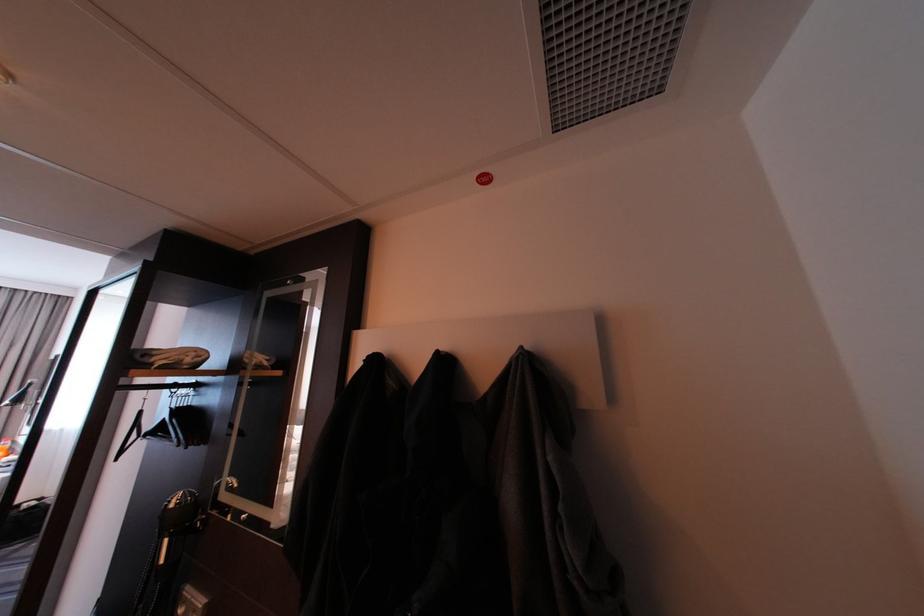
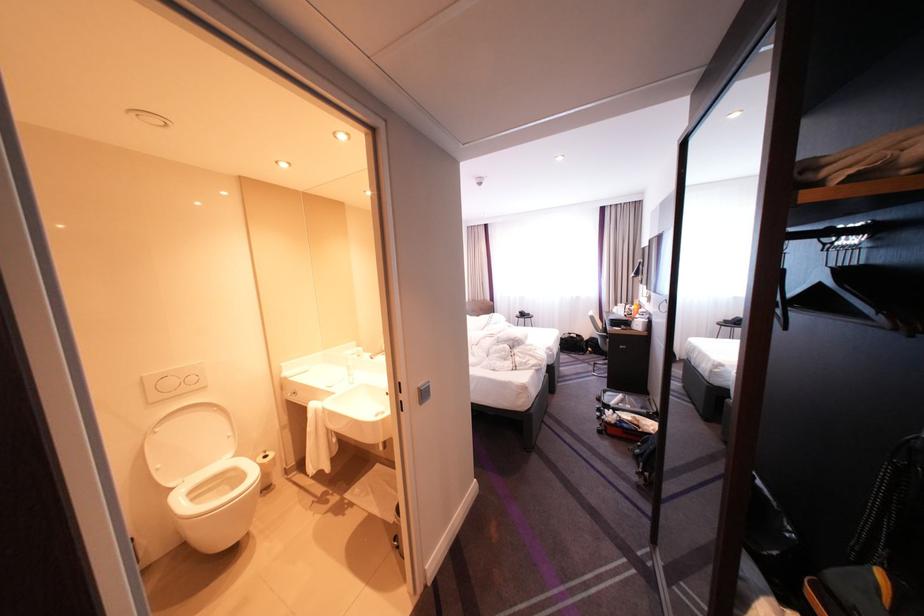
Question: The camera is either moving clockwise (left) or counter-clockwise (right) around the object. The first image is from the beginning of the video and the second image is from the end. Is the camera moving left or right when shooting the video?

Choices:
 (A) Left
 (B) Right

Answer: (B)